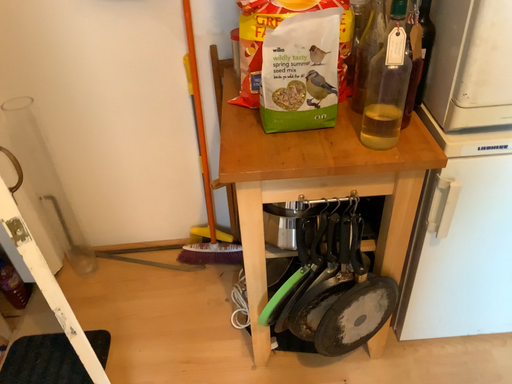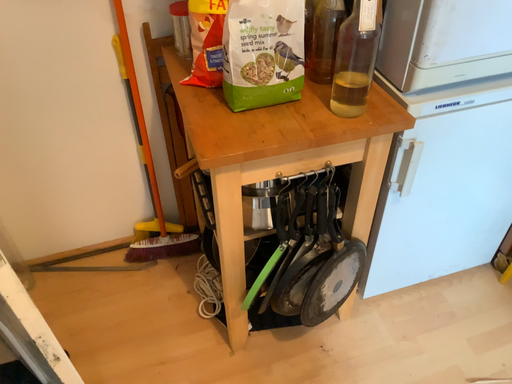
Question: Which way did the camera rotate in the video?

Choices:
 (A) rotated left
 (B) rotated right

Answer: (B)